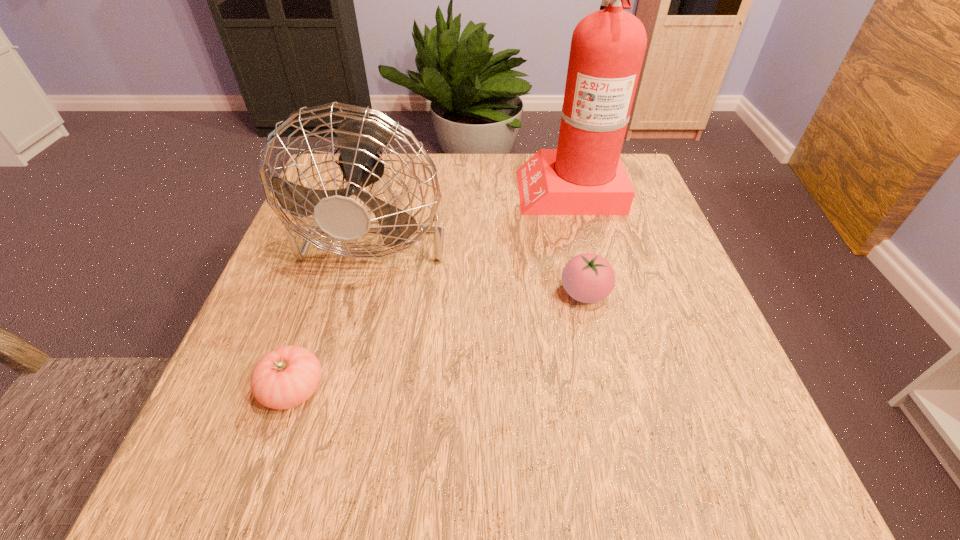
Locate an element on the screen. blank space located 0.310m on the front of the third tallest object is located at coordinates (629, 487).

You are a GUI agent. You are given a task and a screenshot of the screen. Output one action in this format:
    pyautogui.click(x=<x>, y=<y>)
    Task: Click on the free space located on the left of the nearer tomato
    The width and height of the screenshot is (960, 540).
    Given the screenshot: What is the action you would take?
    pyautogui.click(x=218, y=389)

Find the location of a particular element. The width and height of the screenshot is (960, 540). fire extinguisher that is at the far edge is located at coordinates (584, 176).

Identify the location of fan at the far edge. (360, 137).

Identify the location of fan present at the left edge. The width and height of the screenshot is (960, 540). (360, 137).

Locate an element on the screen. This screenshot has height=540, width=960. tomato that is at the left edge is located at coordinates (286, 377).

In order to click on object present at the right edge in this screenshot , I will do pyautogui.click(x=584, y=176).

The height and width of the screenshot is (540, 960). I want to click on object situated at the far left corner, so click(360, 137).

Identify the location of object located at the far right corner. 584,176.

The height and width of the screenshot is (540, 960). Identify the location of vacant space at the far edge of the desktop. 496,154.